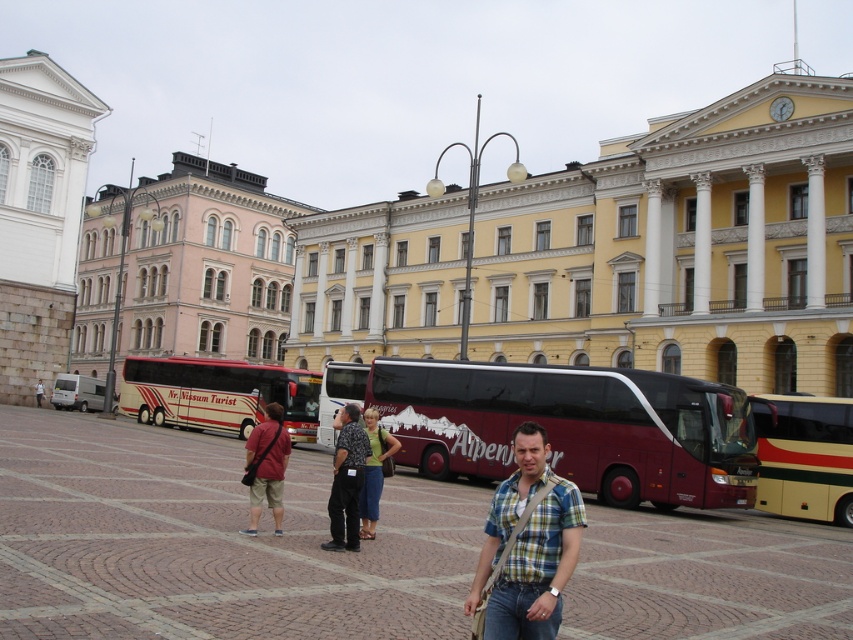
Does point (537, 452) come closer to viewer compared to point (271, 396)?

That is True.

Can you confirm if plaid cotton shirt at center is wider than beige fabric coach at center?

In fact, plaid cotton shirt at center might be narrower than beige fabric coach at center.

This screenshot has height=640, width=853. I want to click on plaid cotton shirt at center, so click(x=527, y=545).

Where is `plaid cotton shirt at center`? plaid cotton shirt at center is located at coordinates (527, 545).

In the scene shown: Does plaid cotton shirt at center have a larger size compared to matte red shirt at center?

Incorrect, plaid cotton shirt at center is not larger than matte red shirt at center.

The width and height of the screenshot is (853, 640). What do you see at coordinates (527, 545) in the screenshot?
I see `plaid cotton shirt at center` at bounding box center [527, 545].

Where is `plaid cotton shirt at center`? plaid cotton shirt at center is located at coordinates (527, 545).

Is maroon leather bus at center to the left of dark blue jeans at center from the viewer's perspective?

No, maroon leather bus at center is not to the left of dark blue jeans at center.

Is maroon leather bus at center thinner than dark blue jeans at center?

Incorrect, maroon leather bus at center's width is not less than dark blue jeans at center's.

Find the location of a particular element. The image size is (853, 640). maroon leather bus at center is located at coordinates (805, 456).